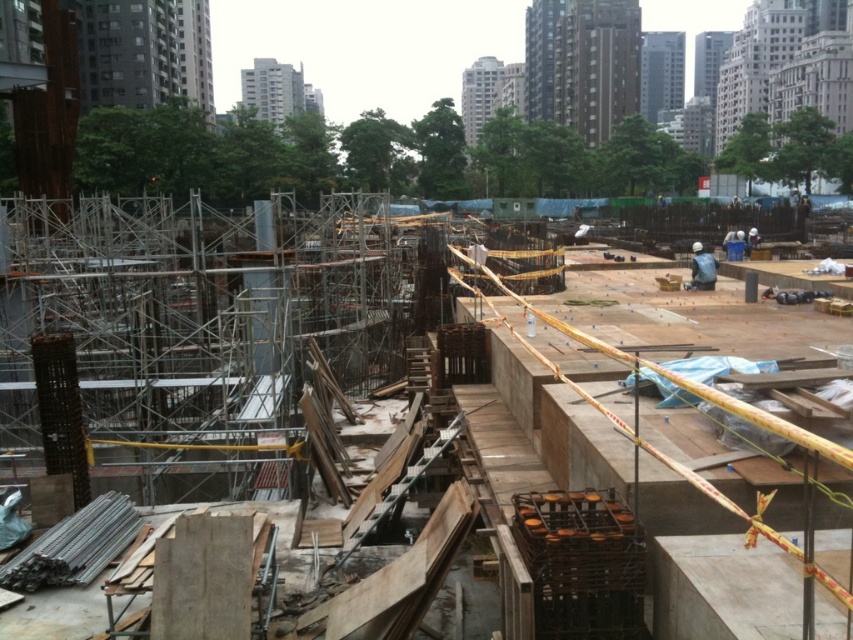
Between silver metallic scaffolding at center and concrete at center, which one has less height?

concrete at center

Is silver metallic scaffolding at center further to camera compared to concrete at center?

Yes, it is.

The image size is (853, 640). What are the coordinates of `silver metallic scaffolding at center` in the screenshot? It's located at (190, 328).

The image size is (853, 640). Identify the location of silver metallic scaffolding at center. (190, 328).

Does concrete scaffolding at center appear over concrete at center?

Indeed, concrete scaffolding at center is positioned over concrete at center.

At what (x,y) coordinates should I click in order to perform the action: click on concrete scaffolding at center. Please return your answer as a coordinate pair (x, y). Looking at the image, I should click on (144, 337).

Based on the photo, is silver metallic scaffolding at center shorter than concrete scaffolding at center?

No, silver metallic scaffolding at center is not shorter than concrete scaffolding at center.

Does silver metallic scaffolding at center have a smaller size compared to concrete scaffolding at center?

No.

Measure the distance between silver metallic scaffolding at center and camera.

silver metallic scaffolding at center is 9.95 meters away from camera.

Where is `silver metallic scaffolding at center`? silver metallic scaffolding at center is located at coordinates (190, 328).